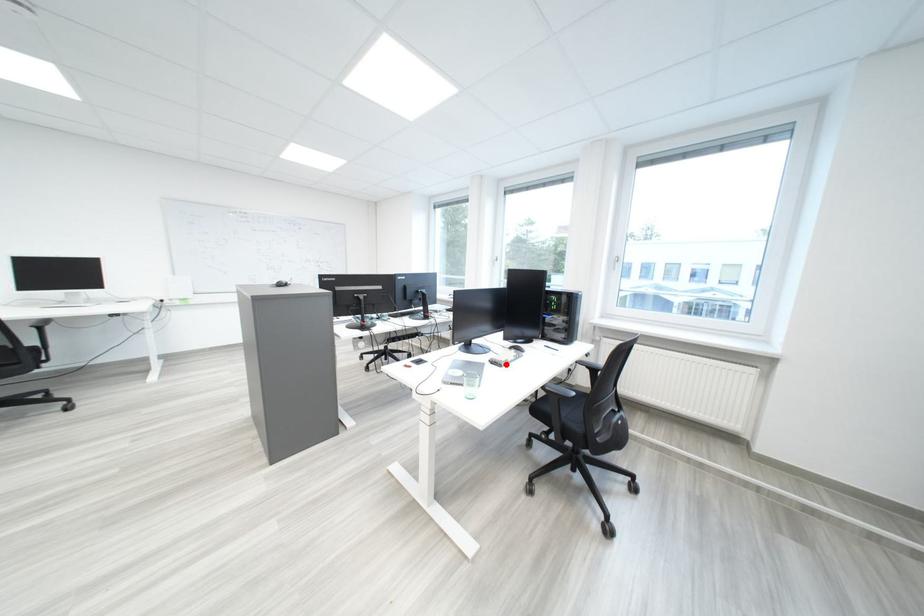
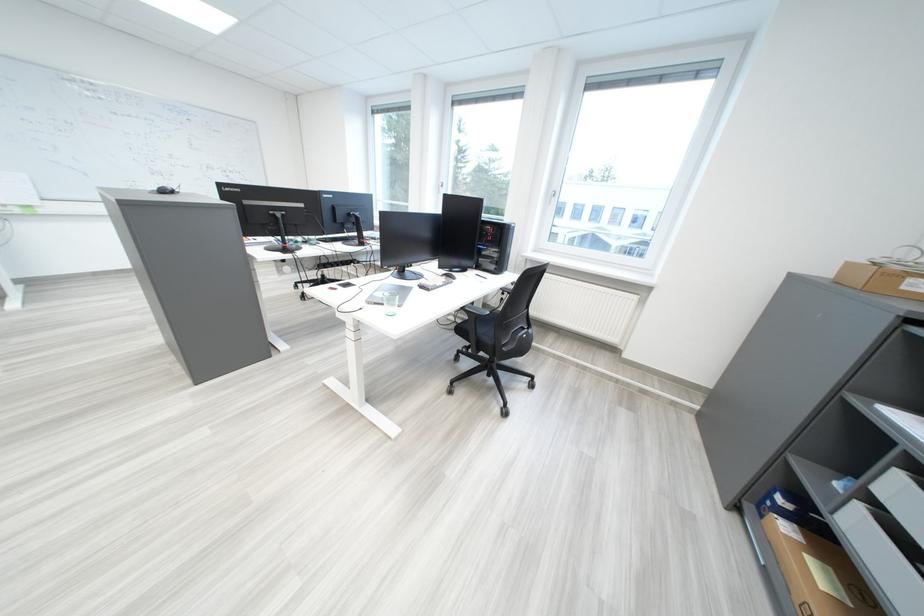
Locate, in the second image, the point that corresponds to the highlighted location in the first image.

(434, 289)